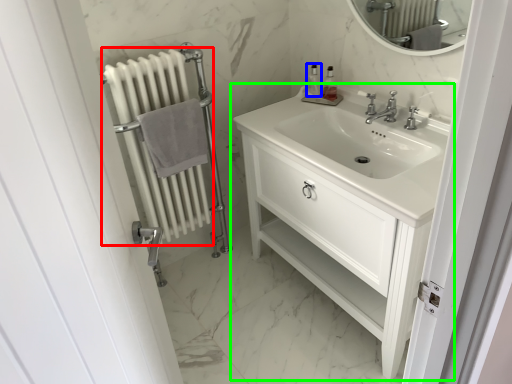
Question: Based on their relative distances, which object is nearer to radiator (highlighted by a red box)? Choose from soap dispenser (highlighted by a blue box) and bathroom cabinet (highlighted by a green box).

Choices:
 (A) soap dispenser
 (B) bathroom cabinet

Answer: (B)